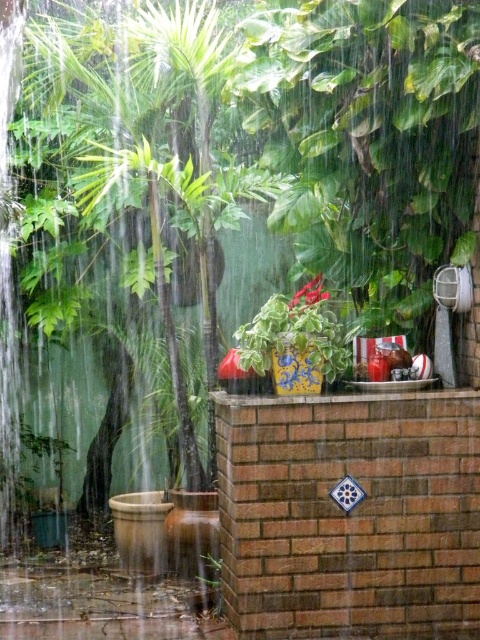
Can you confirm if blue and white ceramic pot at center is shorter than green matte plant at lower center?

No, blue and white ceramic pot at center is not shorter than green matte plant at lower center.

Who is lower down, blue and white ceramic pot at center or green matte plant at lower center?

green matte plant at lower center is lower down.

In order to click on blue and white ceramic pot at center in this screenshot , I will do `click(296, 340)`.

Locate an element on the screen. The height and width of the screenshot is (640, 480). blue and white ceramic pot at center is located at coordinates (296, 340).